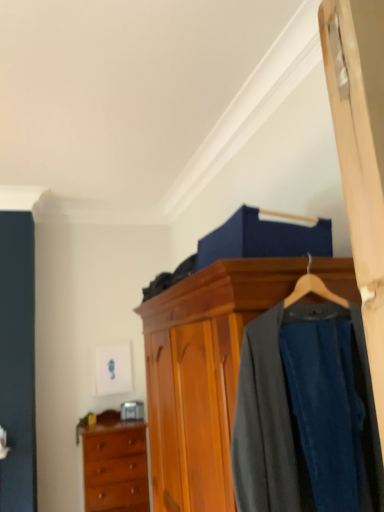
Question: Is wooden wardrobe at center located outside dark gray wool suit at center?

Choices:
 (A) no
 (B) yes

Answer: (B)

Question: Is wooden wardrobe at center shorter than dark gray wool suit at center?

Choices:
 (A) no
 (B) yes

Answer: (A)

Question: Is wooden wardrobe at center looking in the opposite direction of dark gray wool suit at center?

Choices:
 (A) no
 (B) yes

Answer: (A)

Question: From the image's perspective, is wooden wardrobe at center above dark gray wool suit at center?

Choices:
 (A) no
 (B) yes

Answer: (A)

Question: From a real-world perspective, is wooden wardrobe at center located beneath dark gray wool suit at center?

Choices:
 (A) no
 (B) yes

Answer: (B)

Question: Considering the positions of wooden wardrobe at center and wooden chest of drawers at lower left in the image, is wooden wardrobe at center bigger or smaller than wooden chest of drawers at lower left?

Choices:
 (A) small
 (B) big

Answer: (B)

Question: From a real-world perspective, is wooden wardrobe at center physically located above or below wooden chest of drawers at lower left?

Choices:
 (A) above
 (B) below

Answer: (A)

Question: Does point (210, 279) appear closer or farther from the camera than point (122, 466)?

Choices:
 (A) closer
 (B) farther

Answer: (A)

Question: Is wooden wardrobe at center in front of or behind wooden chest of drawers at lower left in the image?

Choices:
 (A) front
 (B) behind

Answer: (A)

Question: Is wooden wardrobe at center in front of or behind dark gray wool suit at center in the image?

Choices:
 (A) front
 (B) behind

Answer: (A)

Question: From their relative heights in the image, would you say wooden wardrobe at center is taller or shorter than dark gray wool suit at center?

Choices:
 (A) short
 (B) tall

Answer: (B)

Question: From a real-world perspective, is wooden wardrobe at center above or below dark gray wool suit at center?

Choices:
 (A) below
 (B) above

Answer: (A)

Question: Is point (221, 359) positioned closer to the camera than point (334, 488)?

Choices:
 (A) farther
 (B) closer

Answer: (A)

Question: Is point (367, 384) closer or farther from the camera than point (203, 382)?

Choices:
 (A) farther
 (B) closer

Answer: (B)

Question: Based on their positions, is dark gray wool suit at center located to the left or right of wooden wardrobe at center?

Choices:
 (A) right
 (B) left

Answer: (A)